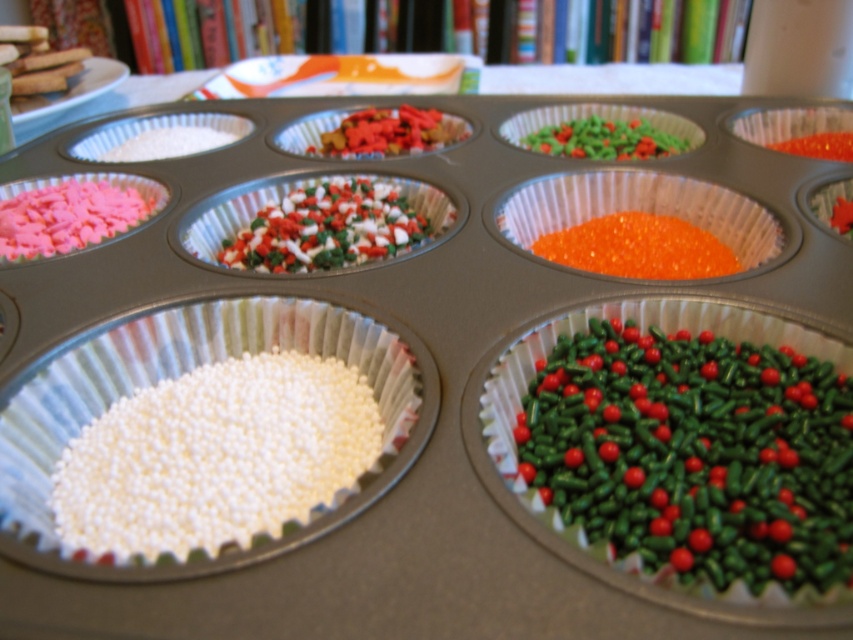
Does white matte sprinkles at center left have a lesser height compared to orange glossy sprinkles at center?

No, white matte sprinkles at center left is not shorter than orange glossy sprinkles at center.

Which is in front, point (180, 371) or point (651, 252)?

Positioned in front is point (180, 371).

Locate an element on the screen. The width and height of the screenshot is (853, 640). white matte sprinkles at center left is located at coordinates (177, 374).

Does green glossy sprinkles at center have a larger size compared to orange glossy beads at center?

Yes, green glossy sprinkles at center is bigger than orange glossy beads at center.

Who is higher up, green glossy sprinkles at center or orange glossy beads at center?

Positioned higher is orange glossy beads at center.

Who is more distant from viewer, (686, 388) or (741, 216)?

The point (741, 216) is more distant.

What are the coordinates of `green glossy sprinkles at center` in the screenshot? It's located at (683, 444).

Can you confirm if white matte sprinkles at center left is smaller than multicolored sprinkles at center?

No.

Can you confirm if white matte sprinkles at center left is positioned to the left of multicolored sprinkles at center?

Yes, white matte sprinkles at center left is to the left of multicolored sprinkles at center.

Who is more forward, (212,356) or (384,189)?

Point (212,356) is more forward.

This screenshot has height=640, width=853. I want to click on white matte sprinkles at center left, so click(x=177, y=374).